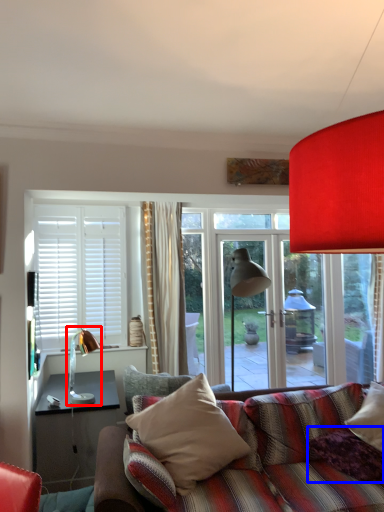
Question: Which object is further to the camera taking this photo, table lamp (highlighted by a red box) or pillow (highlighted by a blue box)?

Choices:
 (A) table lamp
 (B) pillow

Answer: (A)